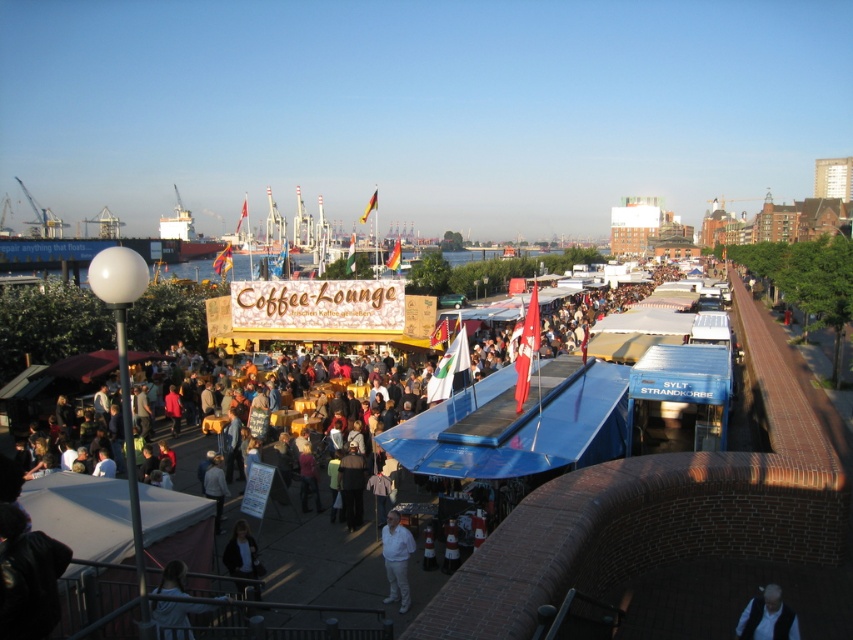
Question: Does light brown leather jacket at lower left have a smaller size compared to dark blue jacket at lower center?

Choices:
 (A) yes
 (B) no

Answer: (A)

Question: Based on their relative distances, which object is nearer to the dark gray wool jacket at lower right?

Choices:
 (A) white cotton shirt at center
 (B) light brown leather jacket at lower left
 (C) dark blue jacket at lower center

Answer: (A)

Question: Can you confirm if dark gray sweater at center is positioned to the right of dark blue jacket at lower center?

Choices:
 (A) yes
 (B) no

Answer: (A)

Question: Which point appears farthest from the camera in this image?

Choices:
 (A) coord(413,548)
 (B) coord(247,577)
 (C) coord(358,458)

Answer: (C)

Question: Estimate the real-world distances between objects in this image. Which object is farther from the white cotton shirt at center?

Choices:
 (A) dark gray wool jacket at lower right
 (B) dark blue jacket at lower center
 (C) dark gray sweater at center

Answer: (A)

Question: Is dark gray wool jacket at lower right above white cotton shirt at center?

Choices:
 (A) no
 (B) yes

Answer: (A)